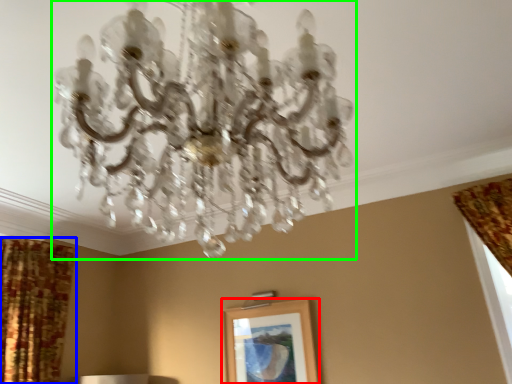
Question: Estimate the real-world distances between objects in this image. Which object is closer to picture frame (highlighted by a red box), curtain (highlighted by a blue box) or lamp (highlighted by a green box)?

Choices:
 (A) curtain
 (B) lamp

Answer: (A)